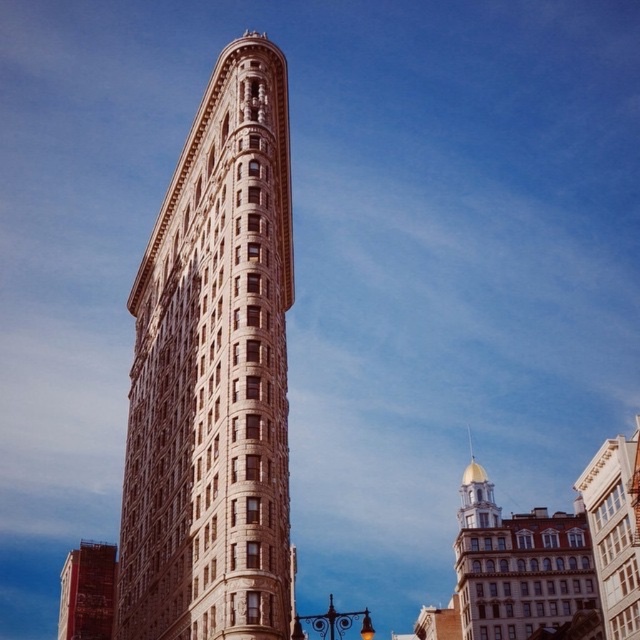
Question: Is beige stone building at center positioned before red brick building at lower left?

Choices:
 (A) no
 (B) yes

Answer: (B)

Question: Which object appears farthest from the camera in this image?

Choices:
 (A) beige stone building at center
 (B) red brick building at lower left

Answer: (B)

Question: Does beige stone building at center have a smaller size compared to red brick building at lower left?

Choices:
 (A) no
 (B) yes

Answer: (B)

Question: Is beige stone building at center further to camera compared to red brick building at lower left?

Choices:
 (A) no
 (B) yes

Answer: (A)

Question: Which of the following is the closest to the observer?

Choices:
 (A) red brick building at lower left
 (B) beige stone building at center

Answer: (B)